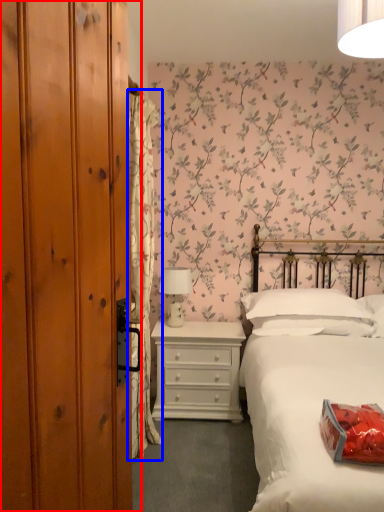
Question: Which object is further to the camera taking this photo, dresser (highlighted by a red box) or curtain (highlighted by a blue box)?

Choices:
 (A) dresser
 (B) curtain

Answer: (B)